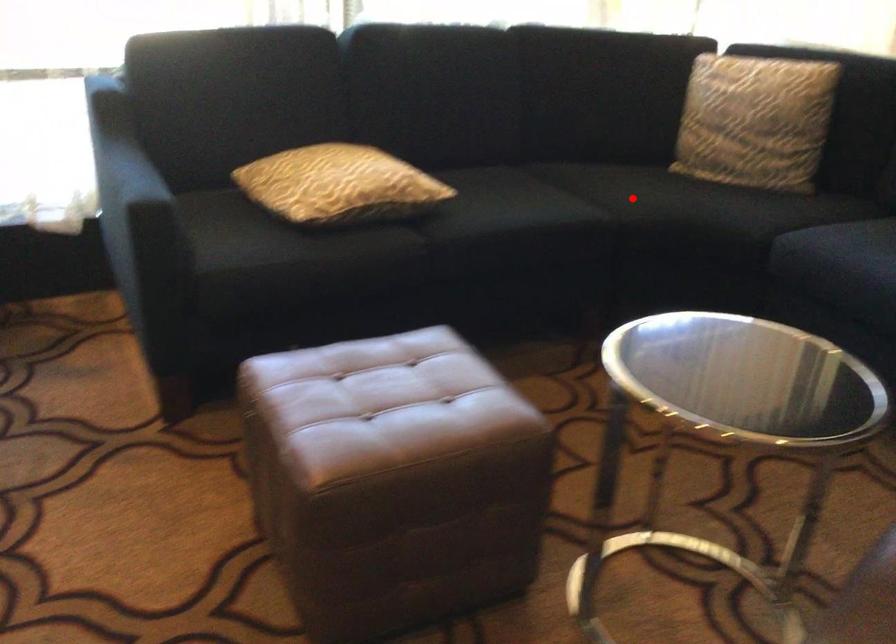
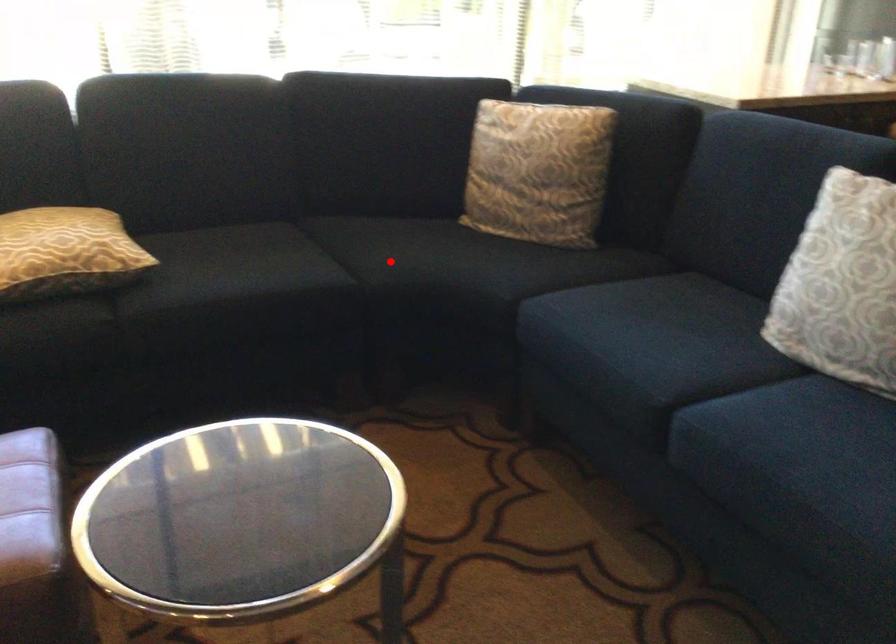
I am providing you with two images of the same scene from different viewpoints. A red point is marked on the first image and another point is marked on the second image. Is the red point in image1 aligned with the point shown in image2?

Yes